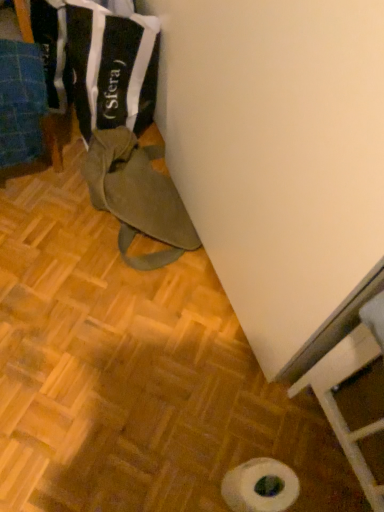
What do you see at coordinates (260, 486) in the screenshot? This screenshot has width=384, height=512. I see `white matte toilet paper at lower center` at bounding box center [260, 486].

How much space does brown matte bag at lower left, arranged as the 2th wood when viewed from the left, occupy horizontally?

The width of brown matte bag at lower left, arranged as the 2th wood when viewed from the left, is 5.23 feet.

The height and width of the screenshot is (512, 384). Describe the element at coordinates (132, 373) in the screenshot. I see `brown matte bag at lower left, the 1th wood viewed from the right` at that location.

Describe the element at coordinates (98, 62) in the screenshot. I see `black fabric bag at upper left` at that location.

What are the coordinates of `blue fabric at left, positioned as the first wood in left-to-right order` in the screenshot? It's located at (53, 140).

Measure the distance between point (51,132) and camera.

The distance of point (51,132) from camera is 4.82 feet.

Locate an element on the screen. white matte toilet paper at lower center is located at coordinates (260, 486).

Locate an element on the screen. laundry above the olive green canvas bag at lower left (from the image's perspective) is located at coordinates (98, 62).

Considering the relative sizes of olive green canvas bag at lower left and black fabric bag at upper left in the image provided, is olive green canvas bag at lower left thinner than black fabric bag at upper left?

Correct, the width of olive green canvas bag at lower left is less than that of black fabric bag at upper left.

Does olive green canvas bag at lower left have a larger size compared to black fabric bag at upper left?

Incorrect, olive green canvas bag at lower left is not larger than black fabric bag at upper left.

From a real-world perspective, which object stands above the other?

black fabric bag at upper left.

Considering the sizes of blue fabric at left, which appears as the second wood when viewed from the right, and brown matte bag at lower left, arranged as the 2th wood when viewed from the left, in the image, is blue fabric at left, which appears as the second wood when viewed from the right, taller or shorter than brown matte bag at lower left, arranged as the 2th wood when viewed from the left,?

Clearly, blue fabric at left, which appears as the second wood when viewed from the right, is taller compared to brown matte bag at lower left, arranged as the 2th wood when viewed from the left.

Which object is closer to the camera taking this photo, blue fabric at left, positioned as the first wood in left-to-right order, or brown matte bag at lower left, arranged as the 2th wood when viewed from the left?

brown matte bag at lower left, arranged as the 2th wood when viewed from the left, is more forward.

The height and width of the screenshot is (512, 384). Find the location of `wood above the brown matte bag at lower left, arranged as the 2th wood when viewed from the left (from the image's perspective)`. wood above the brown matte bag at lower left, arranged as the 2th wood when viewed from the left (from the image's perspective) is located at coordinates (53, 140).

Is blue fabric at left, positioned as the first wood in left-to-right order, surrounding brown matte bag at lower left, arranged as the 2th wood when viewed from the left?

No, blue fabric at left, positioned as the first wood in left-to-right order, does not contain brown matte bag at lower left, arranged as the 2th wood when viewed from the left.

Which is in front, brown matte bag at lower left, arranged as the 2th wood when viewed from the left, or white matte toilet paper at lower center?

white matte toilet paper at lower center is closer to the camera.

Does brown matte bag at lower left, arranged as the 2th wood when viewed from the left, have a lesser width compared to white matte toilet paper at lower center?

In fact, brown matte bag at lower left, arranged as the 2th wood when viewed from the left, might be wider than white matte toilet paper at lower center.

How different are the orientations of brown matte bag at lower left, the 1th wood viewed from the right, and white matte toilet paper at lower center in degrees?

86.6 degrees separate the facing orientations of brown matte bag at lower left, the 1th wood viewed from the right, and white matte toilet paper at lower center.

Is brown matte bag at lower left, the 1th wood viewed from the right, shorter than white matte toilet paper at lower center?

Yes.

In the scene shown: From the image's perspective, is brown matte bag at lower left, arranged as the 2th wood when viewed from the left, located above or below black fabric bag at upper left?

Based on their image positions, brown matte bag at lower left, arranged as the 2th wood when viewed from the left, is located beneath black fabric bag at upper left.

Which is further, (96, 302) or (152, 25)?

Point (96, 302)

In the image, is brown matte bag at lower left, the 1th wood viewed from the right, positioned in front of or behind black fabric bag at upper left?

Clearly, brown matte bag at lower left, the 1th wood viewed from the right, is in front of black fabric bag at upper left.

Does brown matte bag at lower left, arranged as the 2th wood when viewed from the left, touch black fabric bag at upper left?

No, brown matte bag at lower left, arranged as the 2th wood when viewed from the left, is not touching black fabric bag at upper left.

From the image's perspective, between olive green canvas bag at lower left and blue fabric at left, positioned as the first wood in left-to-right order, who is located below?

olive green canvas bag at lower left, from the image's perspective.

Between olive green canvas bag at lower left and blue fabric at left, positioned as the first wood in left-to-right order, which one has smaller size?

blue fabric at left, positioned as the first wood in left-to-right order.

Consider the image. Is olive green canvas bag at lower left taller than blue fabric at left, which appears as the second wood when viewed from the right?

No, olive green canvas bag at lower left is not taller than blue fabric at left, which appears as the second wood when viewed from the right.

From the image's perspective, which object appears higher, brown matte bag at lower left, the 1th wood viewed from the right, or olive green canvas bag at lower left?

olive green canvas bag at lower left.

Is point (201, 365) less distant than point (144, 259)?

Yes, it is in front of point (144, 259).

Which is in front, brown matte bag at lower left, the 1th wood viewed from the right, or olive green canvas bag at lower left?

Positioned in front is brown matte bag at lower left, the 1th wood viewed from the right.

Is brown matte bag at lower left, the 1th wood viewed from the right, next to olive green canvas bag at lower left and touching it?

brown matte bag at lower left, the 1th wood viewed from the right, and olive green canvas bag at lower left are not in contact.

Which is closer, (127, 16) or (125, 245)?

Point (127, 16) is closer to the camera than point (125, 245).

Is black fabric bag at upper left in front of olive green canvas bag at lower left?

Yes.

From the image's perspective, which one is positioned lower, black fabric bag at upper left or olive green canvas bag at lower left?

olive green canvas bag at lower left.

Is olive green canvas bag at lower left located within black fabric bag at upper left?

No, olive green canvas bag at lower left is located outside of black fabric bag at upper left.

Find the location of a particular element. wide on the right side of black fabric bag at upper left is located at coordinates (137, 196).

In the image, there is a blue fabric at left, which appears as the second wood when viewed from the right. At what (x,y) coordinates should I click in order to perform the action: click on wood below it (from a real-world perspective). Please return your answer as a coordinate pair (x, y). Looking at the image, I should click on (132, 373).

When comparing their distances from brown matte bag at lower left, the 1th wood viewed from the right, does white matte toilet paper at lower center or black fabric bag at upper left seem further?

black fabric bag at upper left is positioned further to the anchor brown matte bag at lower left, the 1th wood viewed from the right.

Based on their spatial positions, is blue fabric at left, positioned as the first wood in left-to-right order, or olive green canvas bag at lower left further from white matte toilet paper at lower center?

blue fabric at left, positioned as the first wood in left-to-right order, lies further to white matte toilet paper at lower center than the other object.

Considering their positions, is blue fabric at left, positioned as the first wood in left-to-right order, positioned closer to white matte toilet paper at lower center than brown matte bag at lower left, the 1th wood viewed from the right?

brown matte bag at lower left, the 1th wood viewed from the right, lies closer to white matte toilet paper at lower center than the other object.

Looking at this image, looking at the image, which one is located further to black fabric bag at upper left, brown matte bag at lower left, arranged as the 2th wood when viewed from the left, or olive green canvas bag at lower left?

brown matte bag at lower left, arranged as the 2th wood when viewed from the left, is positioned further to the anchor black fabric bag at upper left.

Looking at the image, which one is located further to blue fabric at left, positioned as the first wood in left-to-right order, white matte toilet paper at lower center or olive green canvas bag at lower left?

white matte toilet paper at lower center is further to blue fabric at left, positioned as the first wood in left-to-right order.

Based on the photo, from the image, which object appears to be nearer to olive green canvas bag at lower left, black fabric bag at upper left or white matte toilet paper at lower center?

black fabric bag at upper left lies closer to olive green canvas bag at lower left than the other object.

Which object lies further to the anchor point white matte toilet paper at lower center, brown matte bag at lower left, arranged as the 2th wood when viewed from the left, or blue fabric at left, positioned as the first wood in left-to-right order?

blue fabric at left, positioned as the first wood in left-to-right order, is positioned further to the anchor white matte toilet paper at lower center.

Which object lies nearer to the anchor point blue fabric at left, positioned as the first wood in left-to-right order, brown matte bag at lower left, the 1th wood viewed from the right, or black fabric bag at upper left?

black fabric bag at upper left lies closer to blue fabric at left, positioned as the first wood in left-to-right order, than the other object.

Identify the location of wide between blue fabric at left, which appears as the second wood when viewed from the right, and white matte toilet paper at lower center, in the vertical direction. (137, 196).

The height and width of the screenshot is (512, 384). What are the coordinates of `wood between black fabric bag at upper left and olive green canvas bag at lower left vertically` in the screenshot? It's located at (53, 140).

Image resolution: width=384 pixels, height=512 pixels. I want to click on wood between blue fabric at left, positioned as the first wood in left-to-right order, and white matte toilet paper at lower center, in the vertical direction, so click(132, 373).

In order to click on wide between black fabric bag at upper left and brown matte bag at lower left, the 1th wood viewed from the right, vertically in this screenshot , I will do `click(137, 196)`.